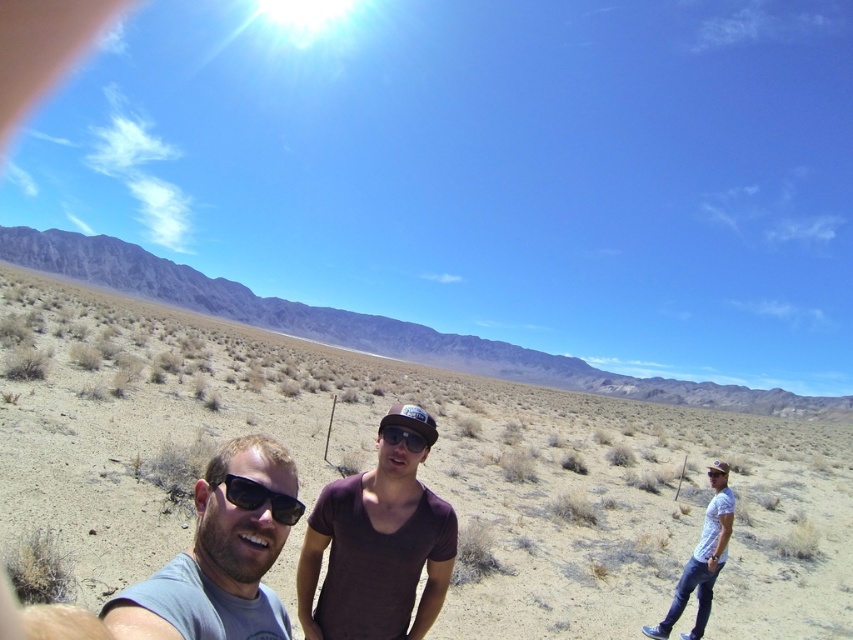
Question: Estimate the real-world distances between objects in this image. Which object is farther from the matte black goggles at center?

Choices:
 (A) brown sandy desert at center
 (B) gray fabric shirt at center
 (C) matte black sunglasses at lower left
 (D) white cotton shirt at right

Answer: (A)

Question: Is gray fabric shirt at center below matte black sunglasses at lower left?

Choices:
 (A) no
 (B) yes

Answer: (B)

Question: Which object appears farthest from the camera in this image?

Choices:
 (A) purple cotton shirt at center
 (B) matte black goggles at center
 (C) gray matte t-shirt at lower left
 (D) gray fabric shirt at center

Answer: (B)

Question: Which object is positioned closest to the gray fabric shirt at center?

Choices:
 (A) purple cotton shirt at center
 (B) white cotton shirt at right
 (C) gray matte t-shirt at lower left
 (D) matte black sunglasses at lower left

Answer: (A)

Question: Does gray fabric shirt at center appear on the left side of white cotton shirt at right?

Choices:
 (A) yes
 (B) no

Answer: (A)

Question: Can you confirm if brown sandy desert at center is thinner than gray fabric shirt at center?

Choices:
 (A) yes
 (B) no

Answer: (B)